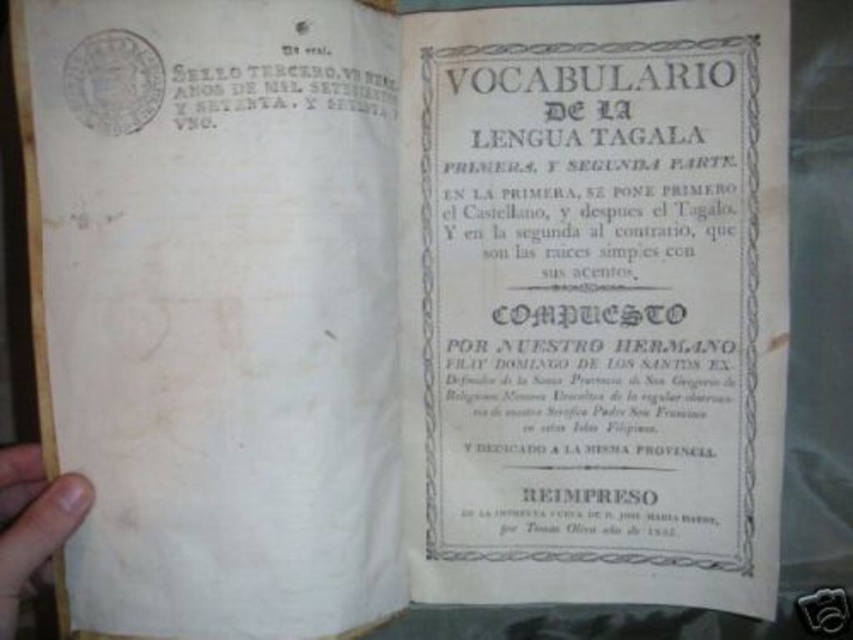
You are a researcher examining the book and need to locate the white paper title page at center. Based on the coordinates provided in the description, can you determine its position relative to the edges of the book?

The white paper title page at center is located at point coordinates 0.472 along the horizontal axis and 0.692 along the vertical axis, meaning it is positioned slightly to the left and closer to the bottom of the book page.

You are a book conservator examining the open book. You need to determine if the white paper title page at center can be placed on the brown wood at lower left without overlapping its edges. Based on their sizes, what do you conclude?

The white paper title page at center is bigger than brown wood at lower left, so it cannot be placed on the brown wood at lower left without overlapping its edges.

You are examining an old book with two points marked on its pages. Point A is at coordinate point(457, 509) and Point B is at coordinate point(9, 538). If you were to place a ruler between these two points, which point would be closer to your eyes?

Point B at coordinate point(9, 538) is closer to your eyes because it is nearer to the viewer compared to Point A at point(457, 509), which is further away.